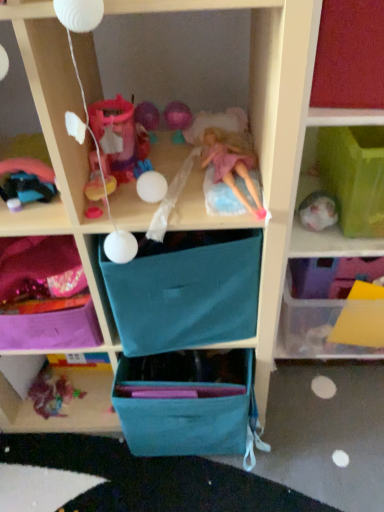
This screenshot has height=512, width=384. Describe the element at coordinates (338, 114) in the screenshot. I see `translucent plastic container at right` at that location.

What do you see at coordinates (186, 291) in the screenshot? I see `teal fabric drawer at center, placed as the 1th drawer when sorted from top to bottom` at bounding box center [186, 291].

The image size is (384, 512). What do you see at coordinates (27, 181) in the screenshot?
I see `shiny metallic car at left, which is the second toy from back to front` at bounding box center [27, 181].

Measure the distance between point (x=235, y=156) and camera.

Point (x=235, y=156) is 33.94 inches from camera.

What do you see at coordinates (232, 163) in the screenshot? The height and width of the screenshot is (512, 384). I see `pink fabric doll at center` at bounding box center [232, 163].

Image resolution: width=384 pixels, height=512 pixels. In order to click on teal fabric drawer at lower center, which is counted as the 1th drawer, starting from the bottom in this screenshot , I will do `click(186, 402)`.

Is teal fabric drawer at center, arranged as the 2th drawer when ordered from the bottom, inside or outside of teal fabric drawer at lower center, the second drawer when ordered from top to bottom?

teal fabric drawer at center, arranged as the 2th drawer when ordered from the bottom, lies outside teal fabric drawer at lower center, the second drawer when ordered from top to bottom.

Consider the image. Looking at the image, does teal fabric drawer at center, arranged as the 2th drawer when ordered from the bottom, seem bigger or smaller compared to teal fabric drawer at lower center, which is counted as the 1th drawer, starting from the bottom?

Clearly, teal fabric drawer at center, arranged as the 2th drawer when ordered from the bottom, is larger in size than teal fabric drawer at lower center, which is counted as the 1th drawer, starting from the bottom.

Is teal fabric drawer at center, placed as the 1th drawer when sorted from top to bottom, wider than teal fabric drawer at lower center, which is counted as the 1th drawer, starting from the bottom?

No.

Which is in front, point (248, 157) or point (163, 392)?

The point (248, 157) is closer.

From a real-world perspective, who is located higher, pink fabric doll at center or teal fabric drawer at lower center, which is counted as the 1th drawer, starting from the bottom?

From a 3D spatial view, pink fabric doll at center is above.

Image resolution: width=384 pixels, height=512 pixels. In order to click on doll in front of the teal fabric drawer at lower center, the second drawer when ordered from top to bottom in this screenshot , I will do `click(232, 163)`.

Is teal fabric drawer at lower center, which is counted as the 1th drawer, starting from the bottom, at the back of pink fabric doll at center?

No, pink fabric doll at center is not facing away from teal fabric drawer at lower center, which is counted as the 1th drawer, starting from the bottom.

From a real-world perspective, relative to shiny metallic car at left, arranged as the first toy when viewed from the front, is multicolored fabric toy at lower left, which is counted as the 2th toy, starting from the top, vertically above or below?

From a real-world perspective, multicolored fabric toy at lower left, which is counted as the 2th toy, starting from the top, is physically below shiny metallic car at left, arranged as the first toy when viewed from the front.

Consider the image. Which of these two, multicolored fabric toy at lower left, arranged as the 1th toy when viewed from the back, or shiny metallic car at left, placed as the 1th toy when sorted from top to bottom, is wider?

multicolored fabric toy at lower left, arranged as the 1th toy when viewed from the back.

From the image's perspective, between multicolored fabric toy at lower left, arranged as the 1th toy when viewed from the back, and shiny metallic car at left, which is the second toy from back to front, who is located below?

multicolored fabric toy at lower left, arranged as the 1th toy when viewed from the back, appears lower in the image.

Is point (30, 395) closer to camera compared to point (15, 178)?

That is False.

Does purple fabric bag at lower left, arranged as the first shelf when viewed from the left, contain pink fabric doll at center?

No, pink fabric doll at center is not surrounded by purple fabric bag at lower left, arranged as the first shelf when viewed from the left.

Which object is closer to the camera taking this photo, purple fabric bag at lower left, arranged as the first shelf when viewed from the left, or pink fabric doll at center?

pink fabric doll at center is in front.

Where is `doll on the right of the purple fabric bag at lower left, which appears as the 3th shelf when viewed from the right`? This screenshot has width=384, height=512. doll on the right of the purple fabric bag at lower left, which appears as the 3th shelf when viewed from the right is located at coordinates (232, 163).

Measure the distance from purple fabric bag at lower left, which appears as the 3th shelf when viewed from the right, to pink fabric doll at center.

The distance of purple fabric bag at lower left, which appears as the 3th shelf when viewed from the right, from pink fabric doll at center is 46.29 centimeters.

Between multicolored fabric toy at lower left, which ranks as the first toy in bottom-to-top order, and teal fabric drawer at lower center, the second drawer when ordered from top to bottom, which one has less height?

Standing shorter between the two is multicolored fabric toy at lower left, which ranks as the first toy in bottom-to-top order.

From the image's perspective, is multicolored fabric toy at lower left, which ranks as the first toy in bottom-to-top order, above teal fabric drawer at lower center, the second drawer when ordered from top to bottom?

Actually, multicolored fabric toy at lower left, which ranks as the first toy in bottom-to-top order, appears below teal fabric drawer at lower center, the second drawer when ordered from top to bottom, in the image.

Can you confirm if multicolored fabric toy at lower left, which ranks as the first toy in bottom-to-top order, is positioned to the right of teal fabric drawer at lower center, the second drawer when ordered from top to bottom?

No, multicolored fabric toy at lower left, which ranks as the first toy in bottom-to-top order, is not to the right of teal fabric drawer at lower center, the second drawer when ordered from top to bottom.

Which point is more distant from viewer, (8, 196) or (370, 250)?

Positioned behind is point (370, 250).

Is shiny metallic car at left, the 2th toy from the bottom, positioned far away from translucent plastic container at right, which is the second shelf in left-to-right order?

No, shiny metallic car at left, the 2th toy from the bottom, is not far from translucent plastic container at right, which is the second shelf in left-to-right order.

Could you measure the distance between shiny metallic car at left, placed as the 1th toy when sorted from top to bottom, and translucent plastic container at right, which is the second shelf in left-to-right order?

26.42 inches.

Does shiny metallic car at left, arranged as the first toy when viewed from the front, have a smaller size compared to translucent plastic container at right, which is the second shelf in left-to-right order?

Indeed, shiny metallic car at left, arranged as the first toy when viewed from the front, has a smaller size compared to translucent plastic container at right, which is the second shelf in left-to-right order.

Which of these two, purple fabric bag at lower left, arranged as the first shelf when viewed from the left, or teal fabric drawer at lower center, which is counted as the 1th drawer, starting from the bottom, is wider?

teal fabric drawer at lower center, which is counted as the 1th drawer, starting from the bottom.

Is purple fabric bag at lower left, arranged as the first shelf when viewed from the left, facing towards teal fabric drawer at lower center, the second drawer when ordered from top to bottom?

No, purple fabric bag at lower left, arranged as the first shelf when viewed from the left, does not turn towards teal fabric drawer at lower center, the second drawer when ordered from top to bottom.

Can you tell me how much purple fabric bag at lower left, arranged as the first shelf when viewed from the left, and teal fabric drawer at lower center, the second drawer when ordered from top to bottom, differ in facing direction?

90.6 degrees.

Considering the positions of objects purple fabric bag at lower left, which appears as the 3th shelf when viewed from the right, and teal fabric drawer at lower center, the second drawer when ordered from top to bottom, in the image provided, who is more to the right, purple fabric bag at lower left, which appears as the 3th shelf when viewed from the right, or teal fabric drawer at lower center, the second drawer when ordered from top to bottom,?

teal fabric drawer at lower center, the second drawer when ordered from top to bottom.

The image size is (384, 512). I want to click on drawer on the left of teal fabric drawer at lower center, which is counted as the 1th drawer, starting from the bottom, so click(186, 291).

This screenshot has height=512, width=384. I want to click on doll on the right side of teal fabric drawer at lower center, the second drawer when ordered from top to bottom, so click(x=232, y=163).

From the image, which object appears to be nearer to teal fabric drawer at lower center, the second drawer when ordered from top to bottom, purple fabric bag at lower left, arranged as the first shelf when viewed from the left, or shiny metallic car at left, the 2th toy from the bottom?

purple fabric bag at lower left, arranged as the first shelf when viewed from the left, lies closer to teal fabric drawer at lower center, the second drawer when ordered from top to bottom, than the other object.

From the image, which object appears to be nearer to pink fabric doll at center, teal fabric drawer at lower center, which is counted as the 1th drawer, starting from the bottom, or translucent plastic container at right, which is the second shelf in left-to-right order?

translucent plastic container at right, which is the second shelf in left-to-right order.

Consider the image. Considering their positions, is translucent plastic container at right positioned further to purple fabric bag at lower left, arranged as the first shelf when viewed from the left, than translucent plastic container at right, which appears as the second shelf when viewed from the right?

→ Among the two, translucent plastic container at right is located further to purple fabric bag at lower left, arranged as the first shelf when viewed from the left.

Looking at the image, which one is located closer to transparent plastic container at right, which is the 1th shelf in right-to-left order, translucent plastic container at right, which appears as the second shelf when viewed from the right, or teal fabric drawer at lower center, the second drawer when ordered from top to bottom?

translucent plastic container at right, which appears as the second shelf when viewed from the right, is positioned closer to the anchor transparent plastic container at right, which is the 1th shelf in right-to-left order.

From the image, which object appears to be farther from shiny metallic car at left, arranged as the first toy when viewed from the front, teal fabric drawer at lower center, the second drawer when ordered from top to bottom, or teal fabric drawer at center, placed as the 1th drawer when sorted from top to bottom?

teal fabric drawer at lower center, the second drawer when ordered from top to bottom, is positioned further to the anchor shiny metallic car at left, arranged as the first toy when viewed from the front.

In the scene shown: Considering their positions, is translucent plastic container at right positioned further to teal fabric drawer at lower center, the second drawer when ordered from top to bottom, than multicolored fabric toy at lower left, arranged as the 1th toy when viewed from the back?

translucent plastic container at right is further to teal fabric drawer at lower center, the second drawer when ordered from top to bottom.

Looking at the image, which one is located closer to transparent plastic container at right, which is the 1th shelf in right-to-left order, shiny metallic car at left, which is the second toy from back to front, or translucent plastic container at right, which appears as the second shelf when viewed from the right?

translucent plastic container at right, which appears as the second shelf when viewed from the right.

Based on their spatial positions, is teal fabric drawer at center, arranged as the 2th drawer when ordered from the bottom, or translucent plastic container at right, which appears as the second shelf when viewed from the right, closer to shiny metallic car at left, placed as the 1th toy when sorted from top to bottom?

teal fabric drawer at center, arranged as the 2th drawer when ordered from the bottom, lies closer to shiny metallic car at left, placed as the 1th toy when sorted from top to bottom, than the other object.

Where is `shelf between multicolored fabric toy at lower left, arranged as the 1th toy when viewed from the back, and teal fabric drawer at lower center, which is counted as the 1th drawer, starting from the bottom, in the horizontal direction`? The width and height of the screenshot is (384, 512). shelf between multicolored fabric toy at lower left, arranged as the 1th toy when viewed from the back, and teal fabric drawer at lower center, which is counted as the 1th drawer, starting from the bottom, in the horizontal direction is located at coordinates (42, 270).

At what (x,y) coordinates should I click in order to perform the action: click on doll between shiny metallic car at left, the 2th toy from the bottom, and translucent plastic container at right, which appears as the second shelf when viewed from the right, in the horizontal direction. Please return your answer as a coordinate pair (x, y). Image resolution: width=384 pixels, height=512 pixels. Looking at the image, I should click on pos(232,163).

I want to click on toy situated between purple fabric bag at lower left, which appears as the 3th shelf when viewed from the right, and transparent plastic container at right, which is the 1th shelf in right-to-left order, from left to right, so click(27, 181).

You are a GUI agent. You are given a task and a screenshot of the screen. Output one action in this format:
    pyautogui.click(x=<x>, y=<y>)
    Task: Click on the doll between teal fabric drawer at center, placed as the 1th drawer when sorted from top to bottom, and translucent plastic container at right, which is the second shelf in left-to-right order, from left to right
    Image resolution: width=384 pixels, height=512 pixels.
    Given the screenshot: What is the action you would take?
    pyautogui.click(x=232, y=163)